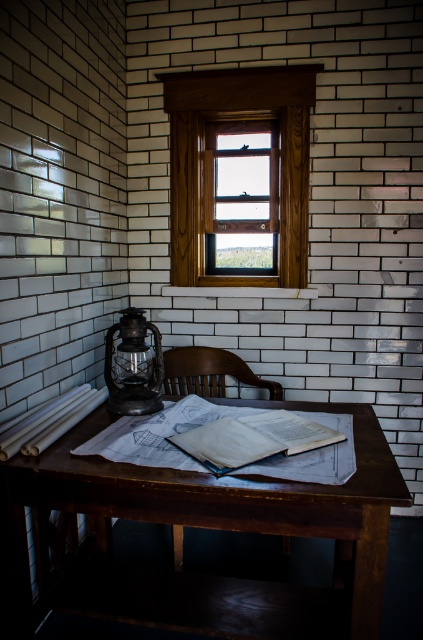
Does white paper book at center appear on the left side of matte black lantern at left?

Incorrect, white paper book at center is not on the left side of matte black lantern at left.

Find the location of a particular element. Image resolution: width=423 pixels, height=640 pixels. white paper book at center is located at coordinates (255, 440).

The height and width of the screenshot is (640, 423). I want to click on white paper book at center, so click(x=255, y=440).

Who is positioned more to the left, dark wood table at center or matte black lantern at left?

matte black lantern at left

What do you see at coordinates (208, 528) in the screenshot? The image size is (423, 640). I see `dark wood table at center` at bounding box center [208, 528].

Where is `dark wood table at center`? dark wood table at center is located at coordinates pyautogui.click(x=208, y=528).

Is white paper book at center bigger than brown wooden chair at center?

Actually, white paper book at center might be smaller than brown wooden chair at center.

Identify the location of white paper book at center. This screenshot has width=423, height=640. (255, 440).